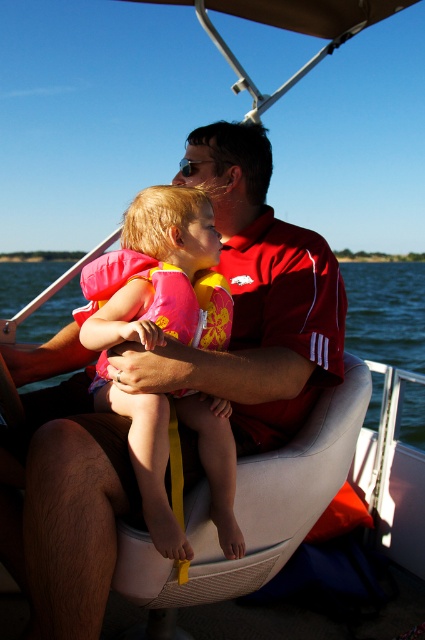
You are a passenger on the boat and need to locate the pink life vest at center. What are its coordinates?

The pink life vest at center is located at coordinates (x=155, y=332).

You are a safety inspector on the boat and need to check the pink life vest at center and the pink fabric life jacket at center. Which one do you need to inspect first without moving your position?

The pink life vest at center should be inspected first because it is closer to you than the pink fabric life jacket at center.

You are standing on the boat and want to reach the point marked at coordinates (388, 298). The boat is 30 meters long. Can you walk from your current position to that point without stepping off the boat?

The distance between you and the point marked at coordinates (388, 298) is 28.26 meters. Since the boat is 30 meters long, you can walk to that point without stepping off the boat.